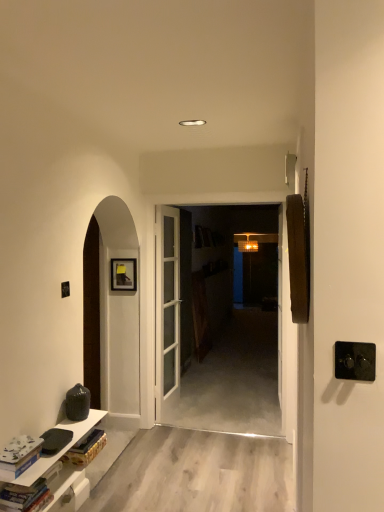
Question: Would you say white matte book at lower left, the 2th book from the bottom, contains white glossy cabinet at lower left?

Choices:
 (A) yes
 (B) no

Answer: (B)

Question: Is white matte book at lower left, the 2th book from the bottom, to the right of white glossy cabinet at lower left from the viewer's perspective?

Choices:
 (A) no
 (B) yes

Answer: (A)

Question: From the image's perspective, would you say white matte book at lower left, the 2th book from the bottom, is positioned over white glossy cabinet at lower left?

Choices:
 (A) no
 (B) yes

Answer: (B)

Question: Is the depth of white matte book at lower left, which appears as the first book when viewed from the top, greater than that of white glossy cabinet at lower left?

Choices:
 (A) no
 (B) yes

Answer: (A)

Question: Are white matte book at lower left, which appears as the first book when viewed from the top, and white glossy cabinet at lower left beside each other?

Choices:
 (A) yes
 (B) no

Answer: (B)

Question: From a real-world perspective, does white matte book at lower left, the 2th book from the bottom, stand above white glossy cabinet at lower left?

Choices:
 (A) yes
 (B) no

Answer: (A)

Question: Is white glossy cabinet at lower left positioned beyond the bounds of black plastic door handle at right?

Choices:
 (A) yes
 (B) no

Answer: (A)

Question: Is white glossy cabinet at lower left far away from black plastic door handle at right?

Choices:
 (A) no
 (B) yes

Answer: (B)

Question: Can you confirm if white glossy cabinet at lower left is positioned to the right of black plastic door handle at right?

Choices:
 (A) yes
 (B) no

Answer: (B)

Question: Considering the relative positions of white glossy cabinet at lower left and black plastic door handle at right in the image provided, is white glossy cabinet at lower left in front of black plastic door handle at right?

Choices:
 (A) yes
 (B) no

Answer: (B)

Question: Considering the relative sizes of white glossy cabinet at lower left and black plastic door handle at right in the image provided, is white glossy cabinet at lower left taller than black plastic door handle at right?

Choices:
 (A) no
 (B) yes

Answer: (A)

Question: Could you tell me if white glossy cabinet at lower left is turned towards black plastic door handle at right?

Choices:
 (A) yes
 (B) no

Answer: (B)

Question: Considering the relative sizes of black plastic door handle at right and hardcover book at lower left, which is counted as the first book, starting from the bottom, in the image provided, is black plastic door handle at right shorter than hardcover book at lower left, which is counted as the first book, starting from the bottom,?

Choices:
 (A) no
 (B) yes

Answer: (A)